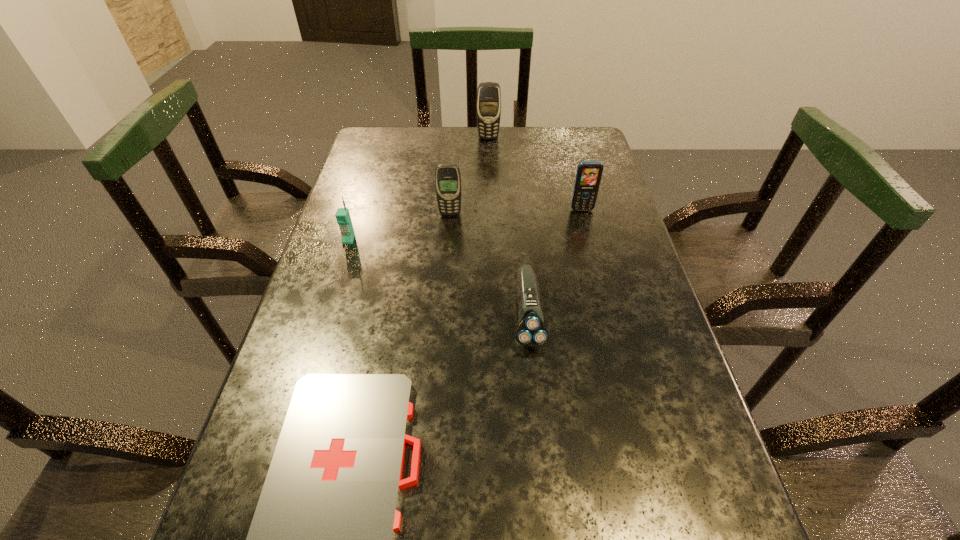
Where is `free space located on the front face of the farthest cellular telephone`? Image resolution: width=960 pixels, height=540 pixels. free space located on the front face of the farthest cellular telephone is located at coordinates (490, 176).

I want to click on vacant region located on the screen of the fourth nearest object, so click(x=448, y=239).

The height and width of the screenshot is (540, 960). What are the coordinates of `blank area located 0.150m on the screen of the third nearest cellular telephone` in the screenshot? It's located at (592, 251).

Locate an element on the screen. The height and width of the screenshot is (540, 960). vacant space positioned 0.120m on the keypad of the third shortest object is located at coordinates (336, 280).

Where is `free space located 0.130m on the head of the fifth object from left to right`? The height and width of the screenshot is (540, 960). free space located 0.130m on the head of the fifth object from left to right is located at coordinates 538,414.

Locate an element on the screen. The width and height of the screenshot is (960, 540). object at the far edge is located at coordinates (489, 94).

Where is `object positioned at the left edge`? The width and height of the screenshot is (960, 540). object positioned at the left edge is located at coordinates (343, 218).

Identify the location of object situated at the right edge. This screenshot has width=960, height=540. (589, 173).

This screenshot has width=960, height=540. I want to click on free space at the far edge, so click(427, 159).

Locate an element on the screen. This screenshot has width=960, height=540. free space at the left edge of the desktop is located at coordinates 362,343.